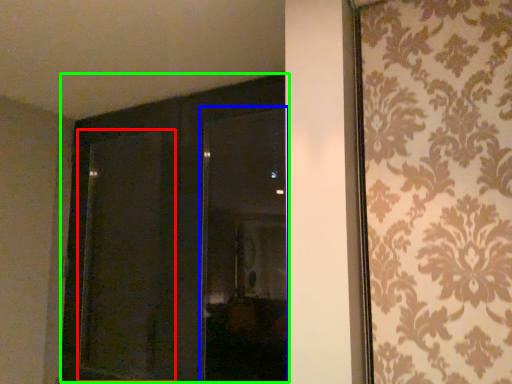
Question: Which object is positioned farthest from screen door (highlighted by a red box)? Select from window (highlighted by a blue box) and door (highlighted by a green box).

Choices:
 (A) window
 (B) door

Answer: (A)